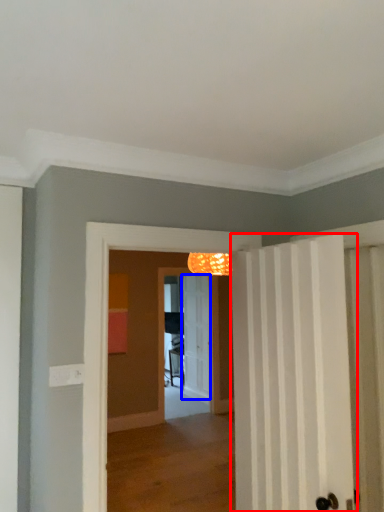
Question: Which of the following is the closest to the observer, door (highlighted by a red box) or door (highlighted by a blue box)?

Choices:
 (A) door
 (B) door

Answer: (A)